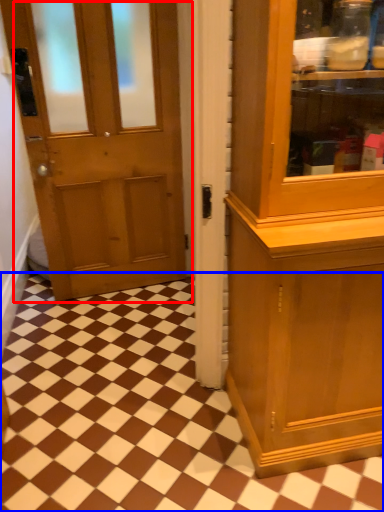
Question: Among these objects, which one is nearest to the camera, door (highlighted by a red box) or tile (highlighted by a blue box)?

Choices:
 (A) door
 (B) tile

Answer: (A)